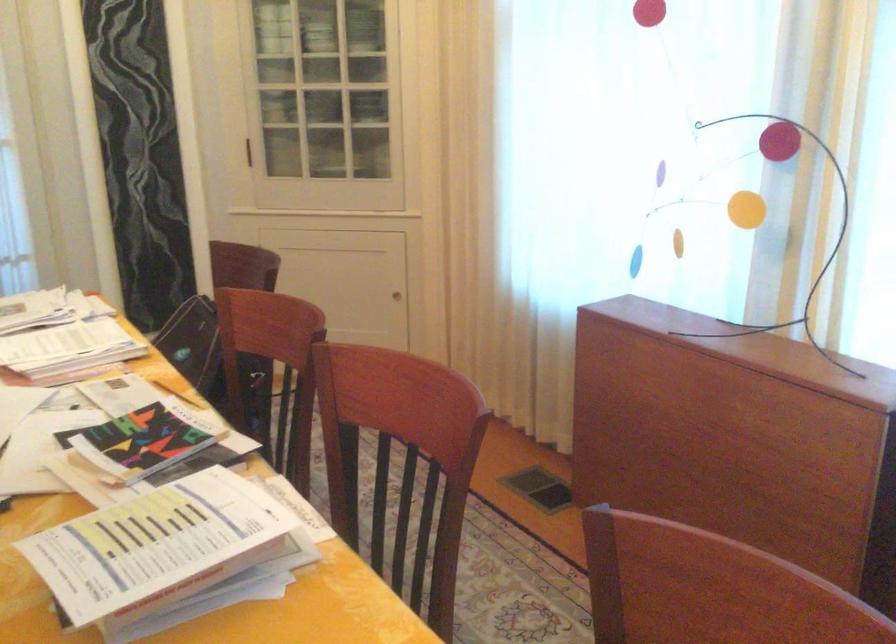
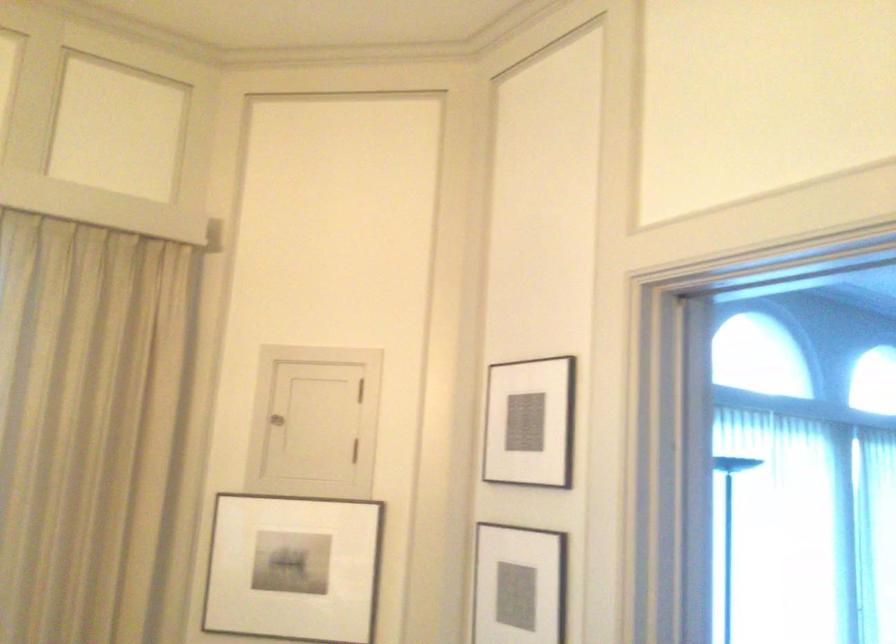
Question: The camera is either moving clockwise (left) or counter-clockwise (right) around the object. The first image is from the beginning of the video and the second image is from the end. Is the camera moving left or right when shooting the video?

Choices:
 (A) Left
 (B) Right

Answer: (A)